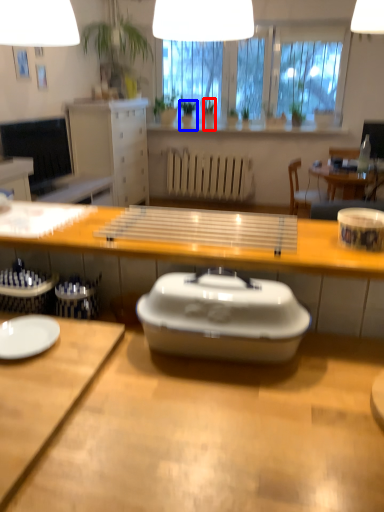
Question: Which of the following is the closest to the observer, houseplant (highlighted by a red box) or houseplant (highlighted by a blue box)?

Choices:
 (A) houseplant
 (B) houseplant

Answer: (A)